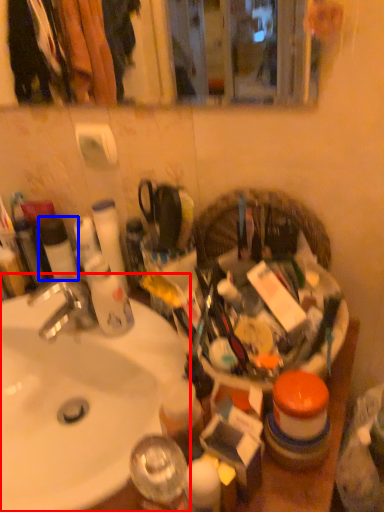
Question: Which object is further to the camera taking this photo, sink (highlighted by a red box) or toiletry (highlighted by a blue box)?

Choices:
 (A) sink
 (B) toiletry

Answer: (B)